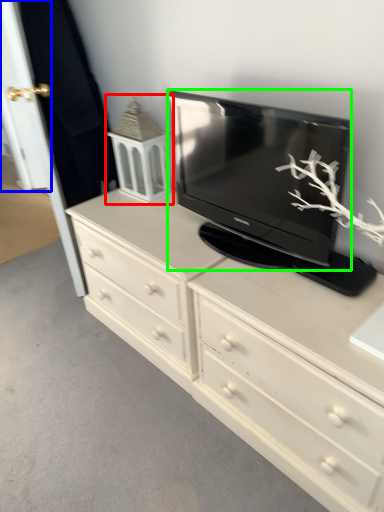
Question: Which object is positioned closest to tv cabinet (highlighted by a red box)? Select from door (highlighted by a blue box) and television (highlighted by a green box).

Choices:
 (A) door
 (B) television

Answer: (B)